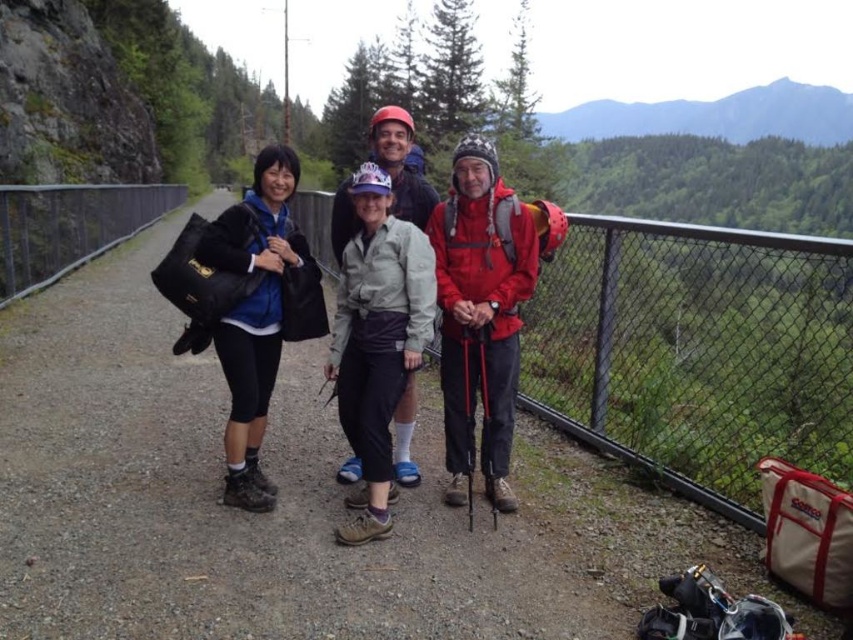
Question: Can you confirm if light gray fabric shirt at center is positioned below metal mesh fence at left?

Choices:
 (A) no
 (B) yes

Answer: (B)

Question: Can you confirm if matte black backpack at center is bigger than light gray fabric shirt at center?

Choices:
 (A) yes
 (B) no

Answer: (A)

Question: Which point is farther to the camera?

Choices:
 (A) (352, 528)
 (B) (28, 218)
 (C) (19, 570)

Answer: (B)

Question: Which object is farther from the camera taking this photo?

Choices:
 (A) matte red jacket at center
 (B) matte black backpack at center

Answer: (A)

Question: Which object appears closest to the camera in this image?

Choices:
 (A) light gray fabric shirt at center
 (B) black matte jacket at left
 (C) matte black backpack at center

Answer: (C)

Question: Does matte black backpack at center come in front of matte red jacket at center?

Choices:
 (A) no
 (B) yes

Answer: (B)